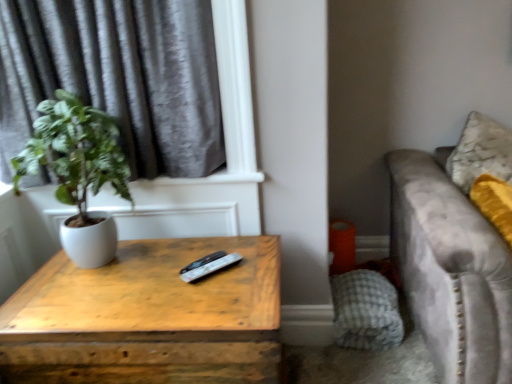
The width and height of the screenshot is (512, 384). In order to click on blank space situated above wooden table at center (from a real-world perspective) in this screenshot , I will do `click(158, 278)`.